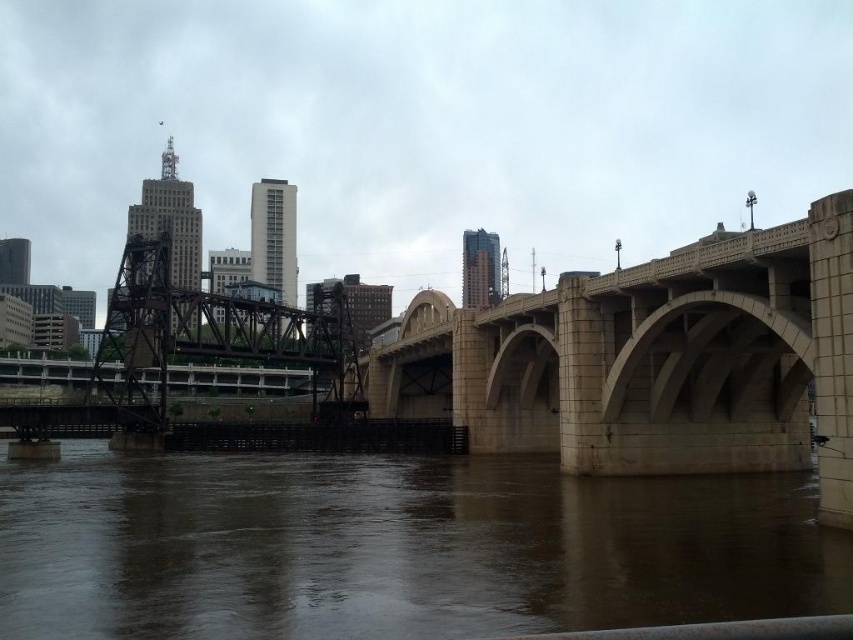
Measure the distance between matte concrete bridge at center and brown concrete river at lower center.

matte concrete bridge at center and brown concrete river at lower center are 154.90 meters apart.

Can you confirm if matte concrete bridge at center is smaller than brown concrete river at lower center?

Actually, matte concrete bridge at center might be larger than brown concrete river at lower center.

Consider the image. Who is more distant from viewer, (119, 3) or (509, 468)?

Positioned behind is point (119, 3).

Locate an element on the screen. The image size is (853, 640). matte concrete bridge at center is located at coordinates [x=421, y=125].